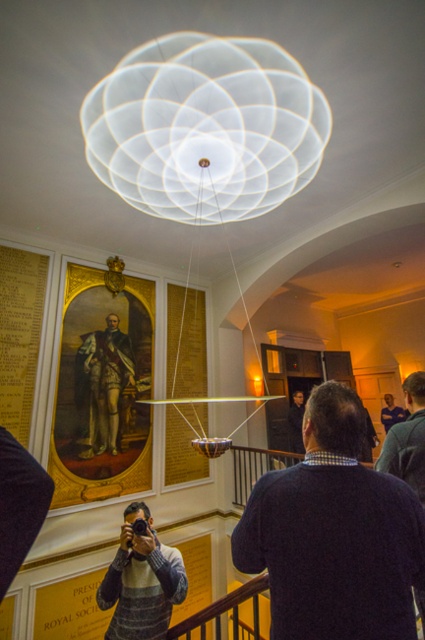
Can you confirm if striped sweater at center is wider than dark blue sweater at lower right?

Correct, the width of striped sweater at center exceeds that of dark blue sweater at lower right.

Between striped sweater at center and dark blue sweater at lower right, which one appears on the right side from the viewer's perspective?

dark blue sweater at lower right is more to the right.

I want to click on striped sweater at center, so point(141,580).

The image size is (425, 640). I want to click on striped sweater at center, so click(141, 580).

Who is positioned more to the right, gold textured uniform at center or dark blue sweater at lower right?

dark blue sweater at lower right is more to the right.

Who is shorter, gold textured uniform at center or dark blue sweater at lower right?

dark blue sweater at lower right

Which is behind, point (116, 355) or point (394, 426)?

The point (116, 355) is more distant.

Find the location of a particular element. gold textured uniform at center is located at coordinates (102, 385).

Can you confirm if striped sweater at center is positioned above gold textured uniform at center?

Actually, striped sweater at center is below gold textured uniform at center.

Is point (141, 579) in front of point (121, 355)?

Yes.

Locate an element on the screen. The width and height of the screenshot is (425, 640). striped sweater at center is located at coordinates (141, 580).